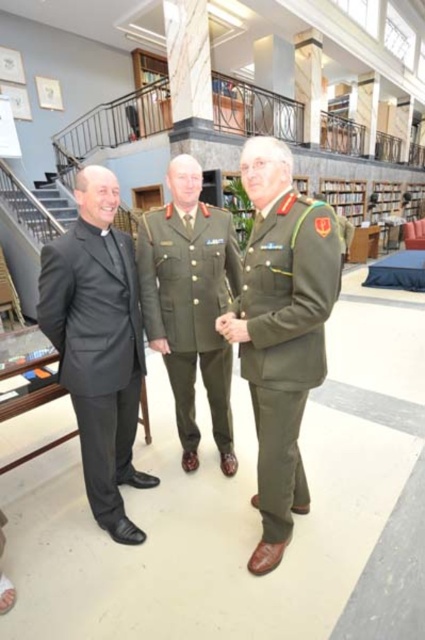
Is the position of matte olive-green uniform at center more distant than that of black matte suit at left?

No, matte olive-green uniform at center is closer to the viewer.

Is matte olive-green uniform at center smaller than black matte suit at left?

Actually, matte olive-green uniform at center might be larger than black matte suit at left.

Who is more forward, [252,372] or [141,376]?

Point [252,372]

You are a GUI agent. You are given a task and a screenshot of the screen. Output one action in this format:
    pyautogui.click(x=<x>, y=<y>)
    Task: Click on the matte olive-green uniform at center
    
    Given the screenshot: What is the action you would take?
    pyautogui.click(x=282, y=330)

Can you confirm if matte olive-green uniform at center is wider than olive green fabric military uniform at center?

In fact, matte olive-green uniform at center might be narrower than olive green fabric military uniform at center.

Is point (300, 371) closer to camera compared to point (209, 364)?

That is True.

The image size is (425, 640). Identify the location of matte olive-green uniform at center. (282, 330).

Which of these two, black matte suit at left or olive green fabric military uniform at center, stands taller?

black matte suit at left is taller.

Is black matte suit at left smaller than olive green fabric military uniform at center?

No, black matte suit at left is not smaller than olive green fabric military uniform at center.

Which is in front, point (133, 337) or point (153, 230)?

Point (133, 337) is in front.

Find the location of a particular element. Image resolution: width=425 pixels, height=640 pixels. black matte suit at left is located at coordinates (98, 344).